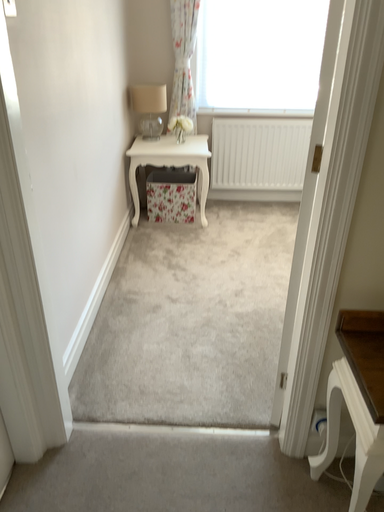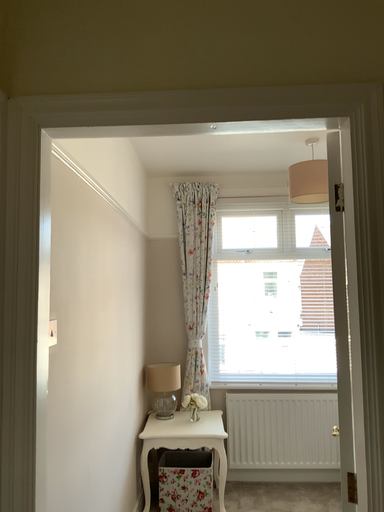
Question: How did the camera likely rotate when shooting the video?

Choices:
 (A) rotated upward
 (B) rotated downward

Answer: (A)